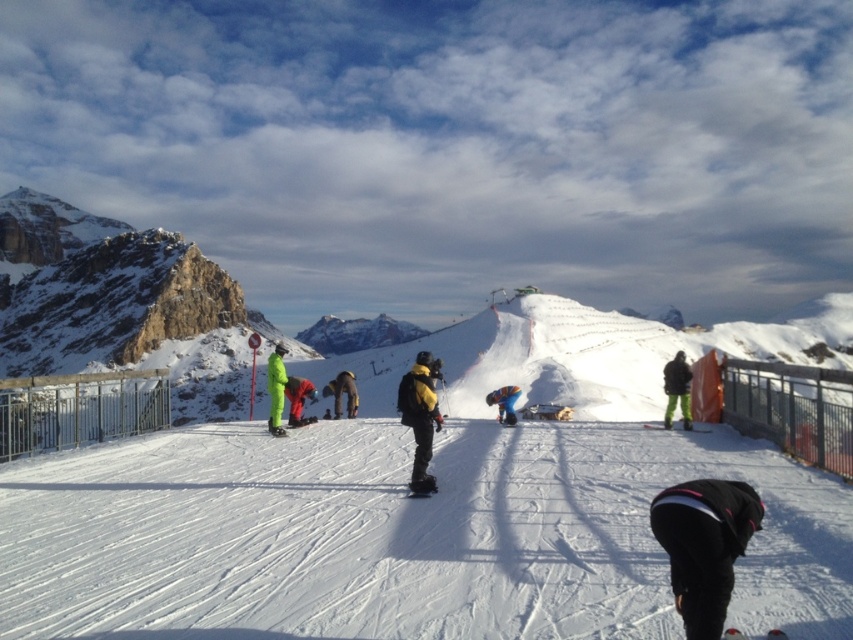
Question: Can you confirm if green matte snow pants at center is positioned to the right of white matte ski at lower center?

Choices:
 (A) no
 (B) yes

Answer: (B)

Question: Based on their relative distances, which object is farther from the black matte pants at lower right?

Choices:
 (A) white matte snow at center
 (B) white matte ski at lower center
 (C) green matte ski at center

Answer: (C)

Question: Which object appears farthest from the camera in this image?

Choices:
 (A) yellow matte snowboarder at center
 (B) green matte snow pants at center
 (C) green matte ski at center
 (D) black matte pants at lower right

Answer: (A)

Question: Is yellow matte snowboarder at center bigger than blue fabric jacket at center?

Choices:
 (A) no
 (B) yes

Answer: (B)

Question: Is yellow matte snowboarder at center to the left of white matte ski at lower center from the viewer's perspective?

Choices:
 (A) no
 (B) yes

Answer: (B)

Question: Which point appears closest to the camera in this image?

Choices:
 (A) (683, 422)
 (B) (334, 394)
 (C) (439, 419)

Answer: (C)